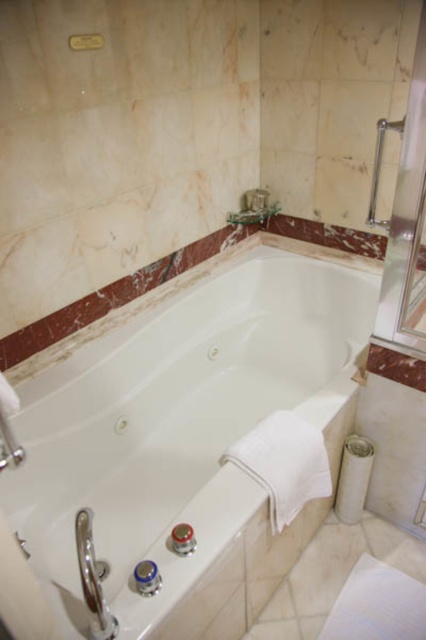
Question: Is transparent glass door at upper right bigger than satin nickel grab bar at upper right?

Choices:
 (A) no
 (B) yes

Answer: (B)

Question: Can you confirm if white glossy bathtub at center is positioned above satin nickel grab bar at upper right?

Choices:
 (A) yes
 (B) no

Answer: (B)

Question: Which object is positioned closest to the transparent glass door at upper right?

Choices:
 (A) white glossy bathtub at center
 (B) satin nickel grab bar at upper right

Answer: (B)

Question: Among these points, which one is farthest from the camera?

Choices:
 (A) 379,164
 (B) 403,116

Answer: (A)

Question: Does white glossy bathtub at center have a greater width compared to transparent glass door at upper right?

Choices:
 (A) yes
 (B) no

Answer: (A)

Question: Which point is closer to the camera?

Choices:
 (A) satin nickel grab bar at upper right
 (B) white glossy bathtub at center

Answer: (A)